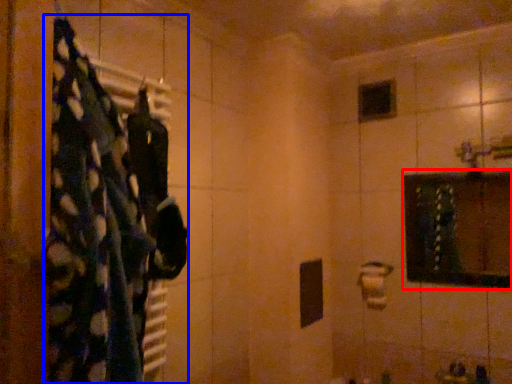
Question: Which point is further to the camera, medicine cabinet (highlighted by a red box) or laundry (highlighted by a blue box)?

Choices:
 (A) medicine cabinet
 (B) laundry

Answer: (A)